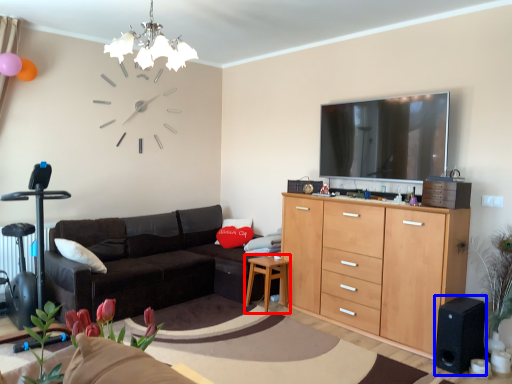
Question: Which object is closer to the camera taking this photo, side table (highlighted by a red box) or speaker (highlighted by a blue box)?

Choices:
 (A) side table
 (B) speaker

Answer: (B)